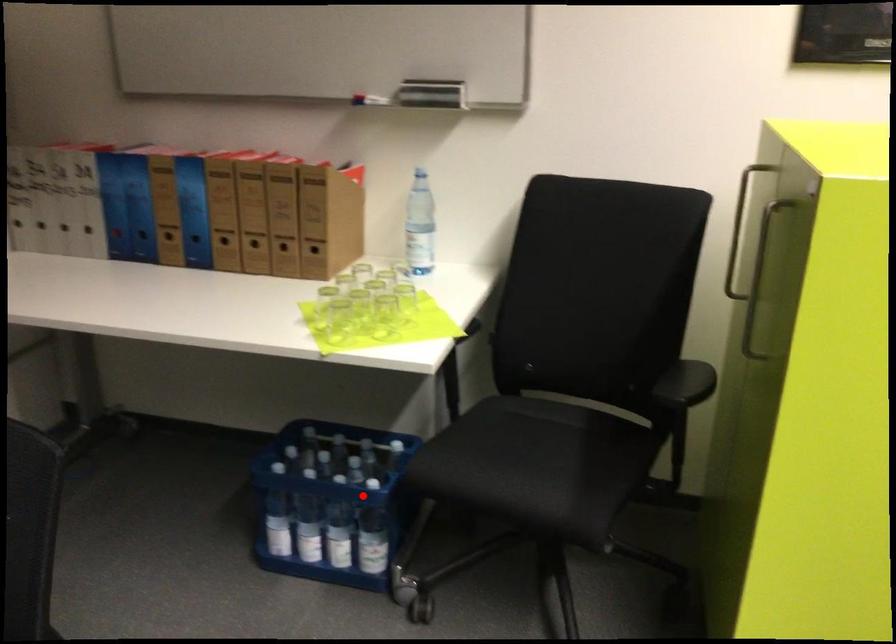
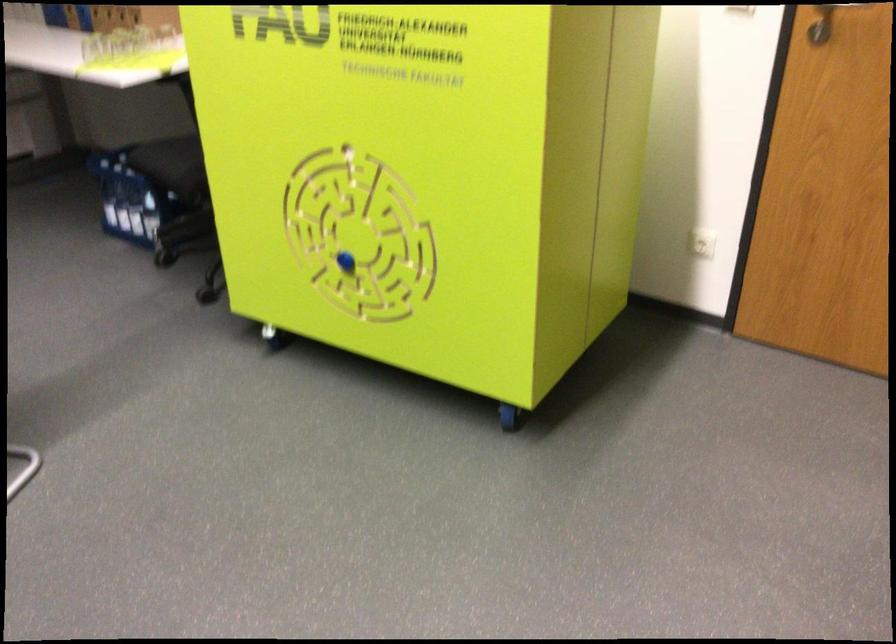
Question: I am providing you with two images of the same scene from different viewpoints. Given a red point in image1, look at the same physical point in image2. Is it:

Choices:
 (A) Closer to the viewpoint
 (B) Farther from the viewpoint

Answer: (B)